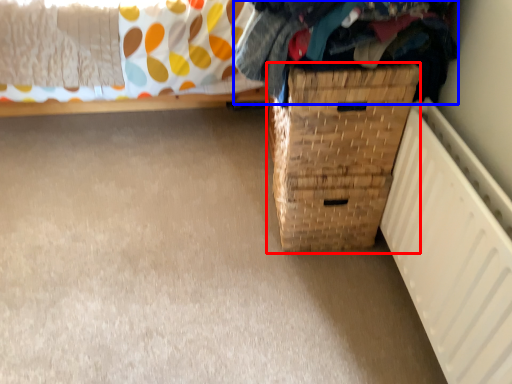
Question: Which of the following is the farthest to the observer, basket container (highlighted by a red box) or clothing (highlighted by a blue box)?

Choices:
 (A) basket container
 (B) clothing

Answer: (A)